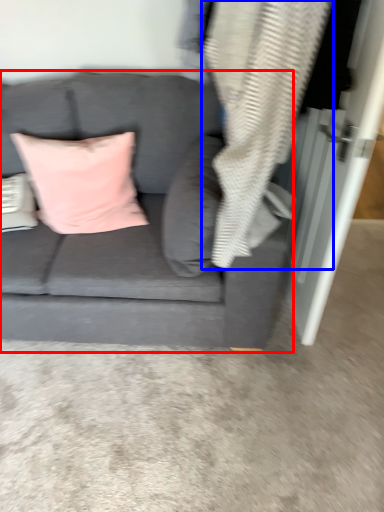
Question: Among these objects, which one is farthest to the camera, studio couch (highlighted by a red box) or material (highlighted by a blue box)?

Choices:
 (A) studio couch
 (B) material

Answer: (A)